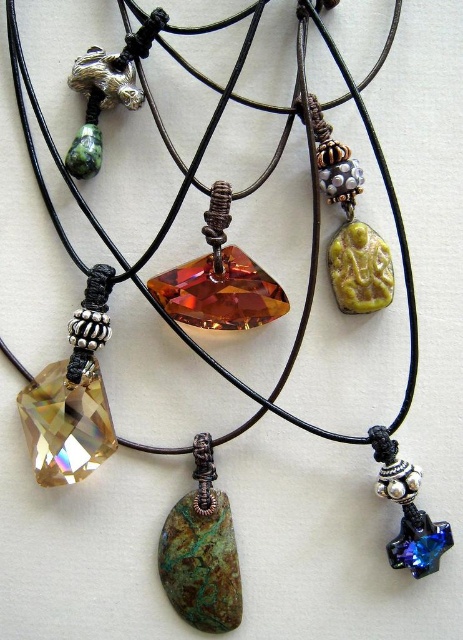
From the picture: You are an appraiser examining the necklaces. You notice a point at coordinates (219, 280). Which necklace pendant is this point located on?

The point at (219, 280) is located on the citrine crystal pendant at center.

You are a jewelry designer trying to create a balanced composition for a display. You have the green stone pendant at center and the blue crystal star at lower right. Which pendant should you place higher to achieve symmetry?

To achieve symmetry, the green stone pendant at center should be placed higher since it has a larger size compared to the blue crystal star at lower right, balancing their visual weight.